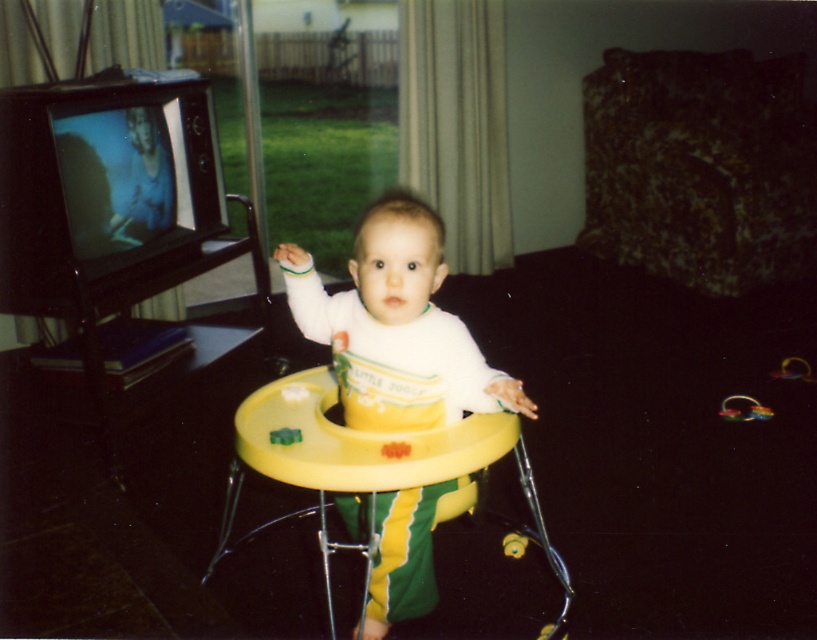
You are a parent trying to move the white matte walker at center and the green plastic walker at center. According to the scene, which one is closer to you?

The white matte walker at center is closer to you because it is in front of the green plastic walker at center.